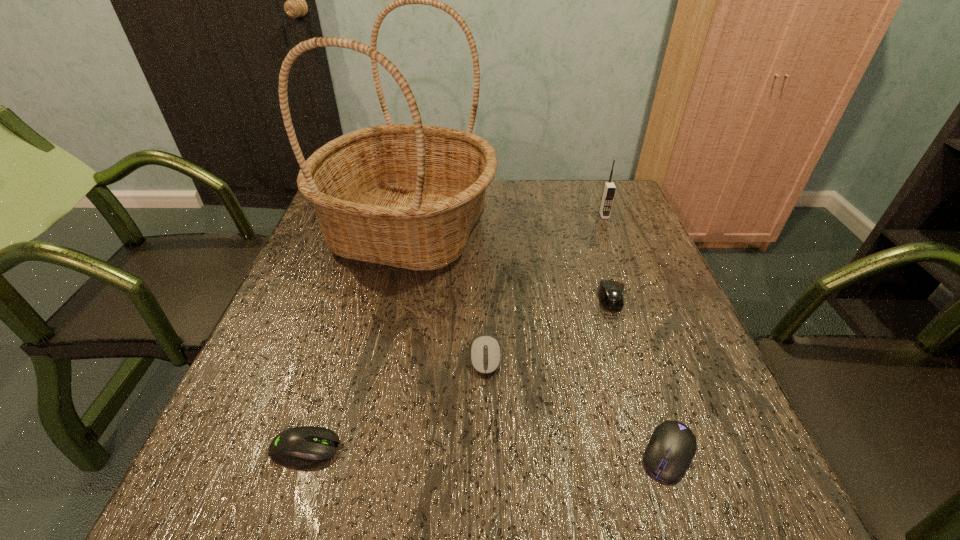
What are the coordinates of `basket` in the screenshot? It's located at (404, 195).

The height and width of the screenshot is (540, 960). What are the coordinates of `the fifth shortest object` in the screenshot? It's located at (609, 189).

Identify the location of the farthest computer mouse. Image resolution: width=960 pixels, height=540 pixels. (611, 292).

Where is `the fourth farthest object`? the fourth farthest object is located at coordinates (485, 352).

At what (x,y) coordinates should I click in order to perform the action: click on the third nearest computer mouse. Please return your answer as a coordinate pair (x, y). This screenshot has width=960, height=540. Looking at the image, I should click on [485, 352].

Find the location of a particular element. This screenshot has width=960, height=540. the leftmost computer mouse is located at coordinates (307, 445).

Locate an element on the screen. The height and width of the screenshot is (540, 960). free region located on the front of the tallest object is located at coordinates (389, 325).

At what (x,y) coordinates should I click in order to perform the action: click on vacant space located on the front-facing side of the cellular telephone. Please return your answer as a coordinate pair (x, y). The height and width of the screenshot is (540, 960). Looking at the image, I should click on (632, 288).

Identify the location of vacant space located on the left of the farthest computer mouse. This screenshot has height=540, width=960. (567, 298).

The width and height of the screenshot is (960, 540). In order to click on vacant region located on the wheel side of the fourth farthest object in this screenshot , I will do `click(487, 452)`.